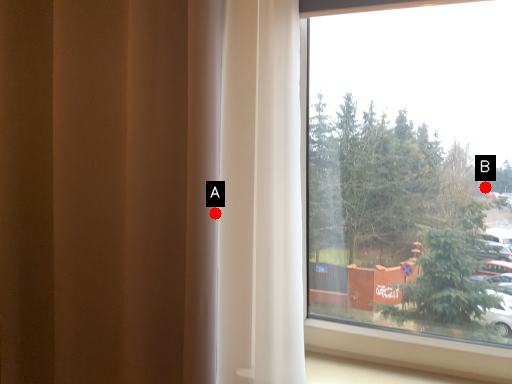
Question: Two points are circled on the image, labeled by A and B beside each circle. Which point is closer to the camera?

Choices:
 (A) A is closer
 (B) B is closer

Answer: (A)